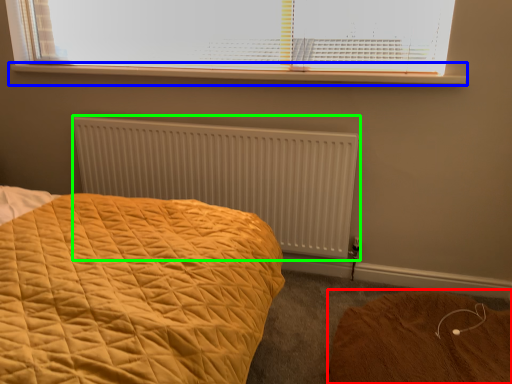
Question: Which object is positioned farthest from plain (highlighted by a red box)? Select from window sill (highlighted by a blue box) and radiator (highlighted by a green box).

Choices:
 (A) window sill
 (B) radiator

Answer: (A)